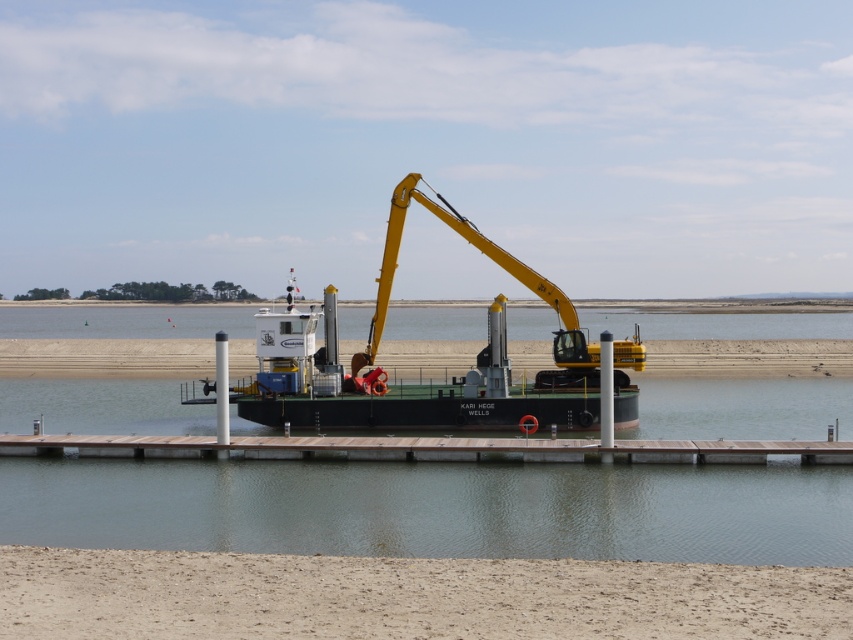
Is point (360, 355) closer to viewer compared to point (624, 442)?

No, it is not.

Who is taller, green matte barge at center or brown wooden dock at center?

Standing taller between the two is brown wooden dock at center.

Is point (479, 356) positioned before point (351, 444)?

No, (479, 356) is behind (351, 444).

At what (x,y) coordinates should I click in order to perform the action: click on green matte barge at center. Please return your answer as a coordinate pair (x, y). Looking at the image, I should click on [460, 378].